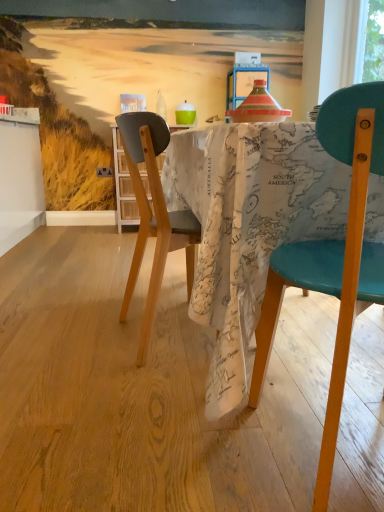
You are a GUI agent. You are given a task and a screenshot of the screen. Output one action in this format:
    pyautogui.click(x=<x>, y=<y>)
    Task: Click on the translucent glass bottle at center
    The height and width of the screenshot is (512, 384).
    Given the screenshot: What is the action you would take?
    pyautogui.click(x=161, y=105)

You are a GUI agent. You are given a task and a screenshot of the screen. Output one action in this format:
    pyautogui.click(x=<x>, y=<y>)
    Task: Click on the wooden floor at center
    This screenshot has width=384, height=512.
    Given the screenshot: What is the action you would take?
    pyautogui.click(x=143, y=390)

You are a GUI agent. You are given a task and a screenshot of the screen. Output one action in this format:
    pyautogui.click(x=<x>, y=<y>)
    Task: Click on the map-patterned fabric at center
    
    Given the screenshot: What is the action you would take?
    pyautogui.click(x=248, y=226)

The width and height of the screenshot is (384, 512). What do you see at coordinates (333, 256) in the screenshot? I see `teal leather chair at right` at bounding box center [333, 256].

Where is `translucent glass bottle at center`? This screenshot has width=384, height=512. translucent glass bottle at center is located at coordinates click(x=161, y=105).

How different are the orientations of teal leather chair at right and map-patterned fabric at center in degrees?

The angular difference between teal leather chair at right and map-patterned fabric at center is 180 degrees.

Is teal leather chair at right positioned beyond the bounds of map-patterned fabric at center?

Indeed, teal leather chair at right is completely outside map-patterned fabric at center.

Can you confirm if teal leather chair at right is bigger than map-patterned fabric at center?

Incorrect, teal leather chair at right is not larger than map-patterned fabric at center.

Consider the image. Can you see translucent glass bottle at center touching map-patterned fabric at center?

translucent glass bottle at center is not next to map-patterned fabric at center, and they're not touching.

Who is shorter, translucent glass bottle at center or map-patterned fabric at center?

Standing shorter between the two is translucent glass bottle at center.

Looking at this image, in the image, is translucent glass bottle at center positioned in front of or behind map-patterned fabric at center?

Clearly, translucent glass bottle at center is behind map-patterned fabric at center.

Does wooden floor at center appear on the right side of translucent glass bottle at center?

Incorrect, wooden floor at center is not on the right side of translucent glass bottle at center.

Choose the correct answer: Is wooden floor at center inside translucent glass bottle at center or outside it?

wooden floor at center is not enclosed by translucent glass bottle at center.

Would you consider wooden floor at center to be distant from translucent glass bottle at center?

That's right, there is a large distance between wooden floor at center and translucent glass bottle at center.

Is translucent glass bottle at center not near wooden floor at center?

Yes, translucent glass bottle at center and wooden floor at center are quite far apart.

Would you say translucent glass bottle at center is to the left or to the right of wooden floor at center in the picture?

Clearly, translucent glass bottle at center is on the right of wooden floor at center in the image.

From the image's perspective, would you say translucent glass bottle at center is positioned over wooden floor at center?

Yes.

Consider the image. Is translucent glass bottle at center outside of map-patterned fabric at center?

Yes, translucent glass bottle at center is located beyond the bounds of map-patterned fabric at center.

There is a map-patterned fabric at center. Identify the location of bottle above it (from a real-world perspective). The height and width of the screenshot is (512, 384). (161, 105).

In the scene shown: Relative to map-patterned fabric at center, is translucent glass bottle at center in front or behind?

Clearly, translucent glass bottle at center is behind map-patterned fabric at center.

Could you tell me if wooden floor at center is facing map-patterned fabric at center?

No, wooden floor at center is not oriented towards map-patterned fabric at center.

From a real-world perspective, is wooden floor at center located higher than map-patterned fabric at center?

No.

Are wooden floor at center and map-patterned fabric at center located far from each other?

wooden floor at center is actually quite close to map-patterned fabric at center.

From the image's perspective, is wooden floor at center under map-patterned fabric at center?

Indeed, from the image's perspective, wooden floor at center is shown beneath map-patterned fabric at center.

Is teal leather chair at right looking in the opposite direction of map-patterned fabric at center?

teal leather chair at right does not have its back to map-patterned fabric at center.

How distant is teal leather chair at right from map-patterned fabric at center?

6.51 inches.

How different are the orientations of teal leather chair at right and map-patterned fabric at center in degrees?

The angular difference between teal leather chair at right and map-patterned fabric at center is 93.4 degrees.

Based on the photo, is teal leather chair at right shorter than map-patterned fabric at center?

No, teal leather chair at right is not shorter than map-patterned fabric at center.

I want to click on kitchen & dining room table behind the teal leather chair at right, so click(128, 172).

Identify the location of kitchen & dining room table that appears on the left of translucent glass bottle at center. The height and width of the screenshot is (512, 384). (128, 172).

When comparing their distances from wooden floor at center, does map-patterned fabric at center or translucent glass bottle at center seem closer?

The object closer to wooden floor at center is map-patterned fabric at center.

Considering their positions, is translucent glass bottle at center positioned closer to teal leather chair at right than map-patterned fabric at center?

map-patterned fabric at center is closer to teal leather chair at right.

Which object lies nearer to the anchor point teal leather chair at right, wooden floor at center or translucent glass bottle at center?

wooden floor at center.

Which object lies further to the anchor point map-patterned fabric at center, wooden floor at center or translucent glass bottle at center?

wooden floor at center is positioned further to the anchor map-patterned fabric at center.

Looking at this image, from the image, which object appears to be nearer to teal leather chair at right, map-patterned fabric at center or translucent glass bottle at center?

map-patterned fabric at center lies closer to teal leather chair at right than the other object.

Estimate the real-world distances between objects in this image. Which object is further from map-patterned fabric at center, teal leather chair at right or translucent glass bottle at center?

Result: Based on the image, teal leather chair at right appears to be further to map-patterned fabric at center.

Which object lies further to the anchor point translucent glass bottle at center, wooden floor at center or map-patterned fabric at center?

map-patterned fabric at center is positioned further to the anchor translucent glass bottle at center.

Which object lies nearer to the anchor point map-patterned fabric at center, translucent glass bottle at center or teal leather chair at right?

Based on the image, teal leather chair at right appears to be nearer to map-patterned fabric at center.

Identify the location of plywood between teal leather chair at right and translucent glass bottle at center in the front-back direction. (143, 390).

The image size is (384, 512). Find the location of `desk located between wooden floor at center and map-patterned fabric at center in the depth direction`. desk located between wooden floor at center and map-patterned fabric at center in the depth direction is located at coordinates (248, 226).

Where is `plywood located between teal leather chair at right and map-patterned fabric at center in the depth direction`? Image resolution: width=384 pixels, height=512 pixels. plywood located between teal leather chair at right and map-patterned fabric at center in the depth direction is located at coordinates (143, 390).

Identify the location of desk positioned between teal leather chair at right and map-patterned fabric at center from near to far. The height and width of the screenshot is (512, 384). (248, 226).